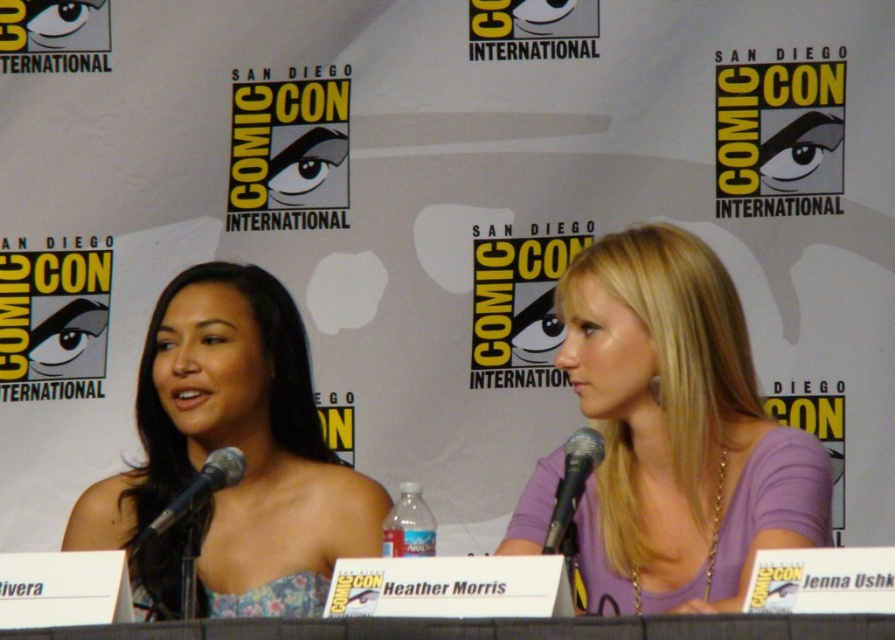
Which is more to the left, floral fabric dress at left or black metallic microphone at left?

black metallic microphone at left is more to the left.

Which is above, floral fabric dress at left or black metallic microphone at left?

Positioned higher is floral fabric dress at left.

Between point (251, 304) and point (229, 464), which one is positioned behind?

Point (251, 304)

The width and height of the screenshot is (895, 640). In order to click on floral fabric dress at left in this screenshot , I will do `click(237, 448)`.

Can you confirm if purple fabric shirt at center is smaller than floral fabric dress at left?

Yes.

Can you confirm if purple fabric shirt at center is shorter than floral fabric dress at left?

Yes, purple fabric shirt at center is shorter than floral fabric dress at left.

Where is `purple fabric shirt at center`? The height and width of the screenshot is (640, 895). purple fabric shirt at center is located at coordinates (678, 429).

Which is more to the left, black metallic microphone at left or black metallic microphone at lower center?

black metallic microphone at left

Does black metallic microphone at left have a greater width compared to black metallic microphone at lower center?

Yes, black metallic microphone at left is wider than black metallic microphone at lower center.

Image resolution: width=895 pixels, height=640 pixels. I want to click on black metallic microphone at left, so click(x=192, y=500).